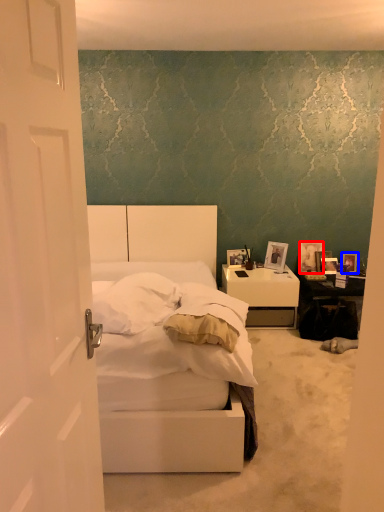
Question: Which point is further to the camera, picture frame (highlighted by a red box) or picture frame (highlighted by a blue box)?

Choices:
 (A) picture frame
 (B) picture frame

Answer: (A)